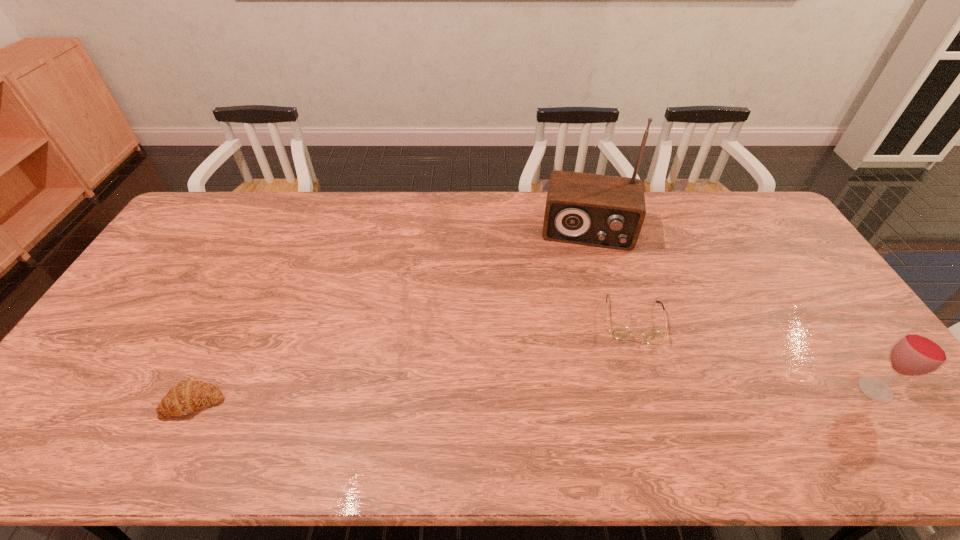
What are the coordinates of `free space at the near edge of the desktop` in the screenshot? It's located at (642, 402).

Identify the location of vacant space at the left edge. (153, 334).

In the image, there is a desktop. Identify the location of vacant space at the right edge. Image resolution: width=960 pixels, height=540 pixels. tap(774, 271).

In the image, there is a desktop. Identify the location of vacant area at the near left corner. The width and height of the screenshot is (960, 540). (67, 412).

Locate an element on the screen. This screenshot has height=540, width=960. blank region between the spectacles and the leftmost object is located at coordinates (414, 361).

The width and height of the screenshot is (960, 540). In order to click on unoccupied position between the farthest object and the second tallest object in this screenshot , I will do `click(732, 310)`.

Where is `vacant space that is in between the wineglass and the crescent roll`? The image size is (960, 540). vacant space that is in between the wineglass and the crescent roll is located at coordinates (535, 396).

This screenshot has width=960, height=540. Find the location of `free space between the spectacles and the wineglass`. free space between the spectacles and the wineglass is located at coordinates (754, 354).

You are a GUI agent. You are given a task and a screenshot of the screen. Output one action in this format:
    pyautogui.click(x=<x>, y=<y>)
    Task: Click on the free space between the spectacles and the farthest object
    This screenshot has height=540, width=960.
    Given the screenshot: What is the action you would take?
    pyautogui.click(x=611, y=274)

Locate an element on the screen. Image resolution: width=960 pixels, height=540 pixels. free space between the spectacles and the wineglass is located at coordinates (754, 354).